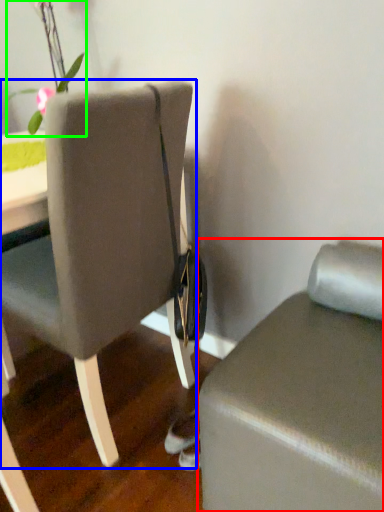
Question: Estimate the real-world distances between objects in this image. Which object is farther from furniture (highlighted by a red box), chair (highlighted by a blue box) or floral arrangement (highlighted by a green box)?

Choices:
 (A) chair
 (B) floral arrangement

Answer: (B)